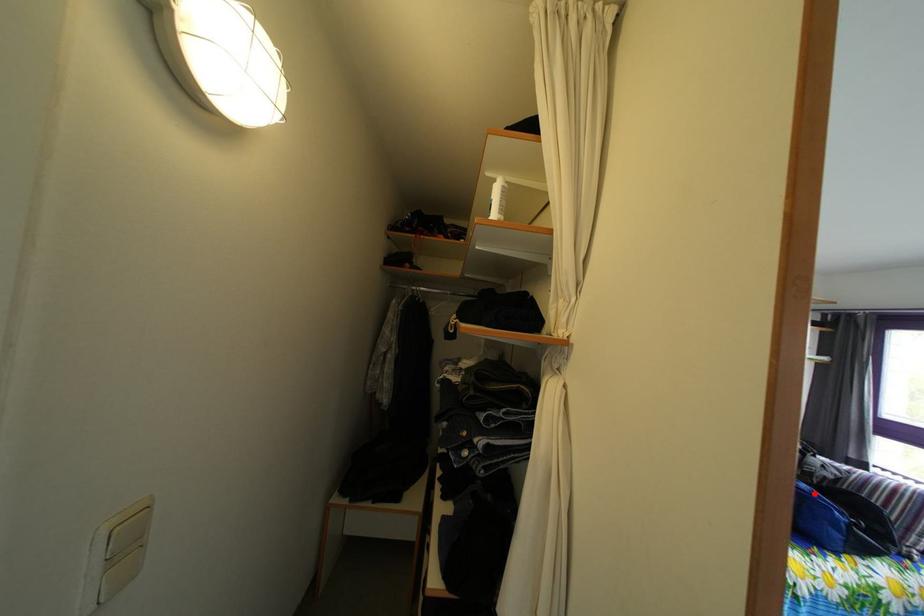
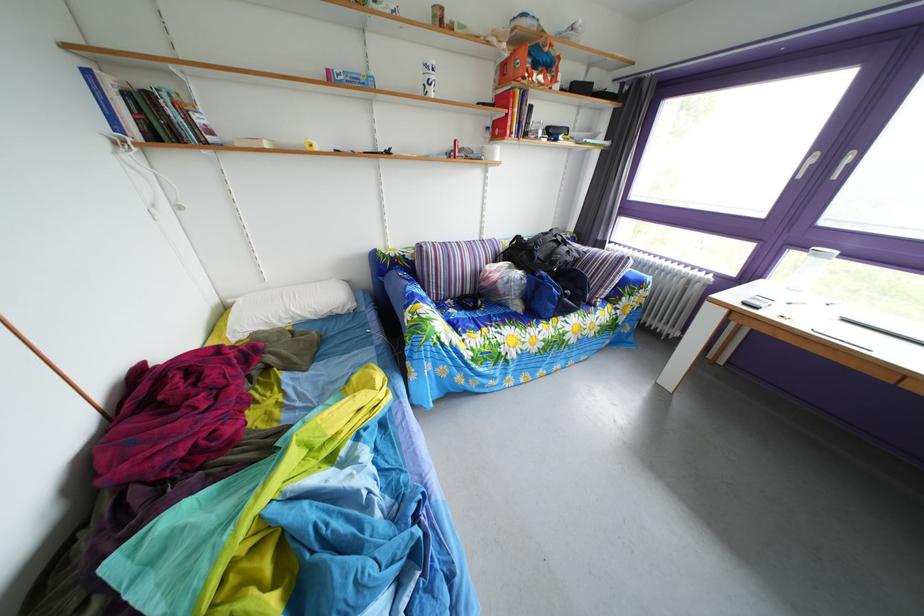
The point at the highlighted location is marked in the first image. Where is the corresponding point in the second image?

(553, 282)